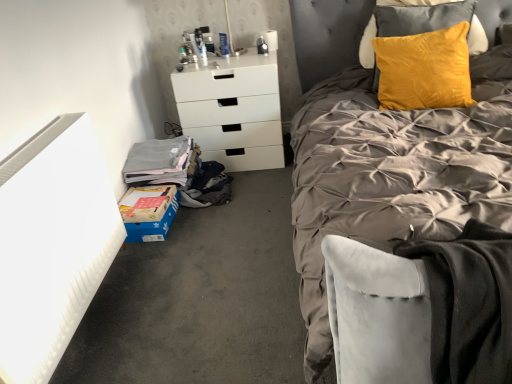
Question: Is blue cardboard box at lower left shorter than white matte chest of drawers at center?

Choices:
 (A) yes
 (B) no

Answer: (A)

Question: Is blue cardboard box at lower left surrounding white matte chest of drawers at center?

Choices:
 (A) yes
 (B) no

Answer: (B)

Question: Is the depth of blue cardboard box at lower left greater than that of white matte chest of drawers at center?

Choices:
 (A) yes
 (B) no

Answer: (B)

Question: Is blue cardboard box at lower left to the left of white matte chest of drawers at center from the viewer's perspective?

Choices:
 (A) yes
 (B) no

Answer: (A)

Question: From the image's perspective, would you say blue cardboard box at lower left is shown under white matte chest of drawers at center?

Choices:
 (A) yes
 (B) no

Answer: (A)

Question: From the image's perspective, relative to silky gray duvet at center, is yellow velvet pillow at upper right above or below?

Choices:
 (A) above
 (B) below

Answer: (A)

Question: From a real-world perspective, is yellow velvet pillow at upper right physically located above or below silky gray duvet at center?

Choices:
 (A) above
 (B) below

Answer: (A)

Question: Visually, is yellow velvet pillow at upper right positioned to the left or to the right of silky gray duvet at center?

Choices:
 (A) right
 (B) left

Answer: (A)

Question: Looking at their shapes, would you say yellow velvet pillow at upper right is wider or thinner than silky gray duvet at center?

Choices:
 (A) thin
 (B) wide

Answer: (A)

Question: Relative to yellow velvet pillow at upper right, is silky gray duvet at center in front or behind?

Choices:
 (A) behind
 (B) front

Answer: (B)

Question: From the image's perspective, relative to yellow velvet pillow at upper right, is silky gray duvet at center above or below?

Choices:
 (A) below
 (B) above

Answer: (A)

Question: Considering the relative positions of silky gray duvet at center and yellow velvet pillow at upper right in the image provided, is silky gray duvet at center to the left or to the right of yellow velvet pillow at upper right?

Choices:
 (A) left
 (B) right

Answer: (A)

Question: Considering the positions of silky gray duvet at center and yellow velvet pillow at upper right in the image, is silky gray duvet at center wider or thinner than yellow velvet pillow at upper right?

Choices:
 (A) wide
 (B) thin

Answer: (A)

Question: Is white matte chest of drawers at center to the left or to the right of blue cardboard box at lower left in the image?

Choices:
 (A) left
 (B) right

Answer: (B)

Question: Is white matte chest of drawers at center inside or outside of blue cardboard box at lower left?

Choices:
 (A) inside
 (B) outside

Answer: (B)